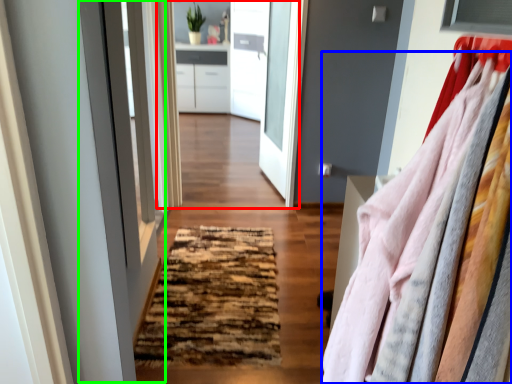
Question: Which object is positioned farthest from clothing store (highlighted by a red box)? Select from clothing (highlighted by a blue box) and screen door (highlighted by a green box).

Choices:
 (A) clothing
 (B) screen door

Answer: (A)